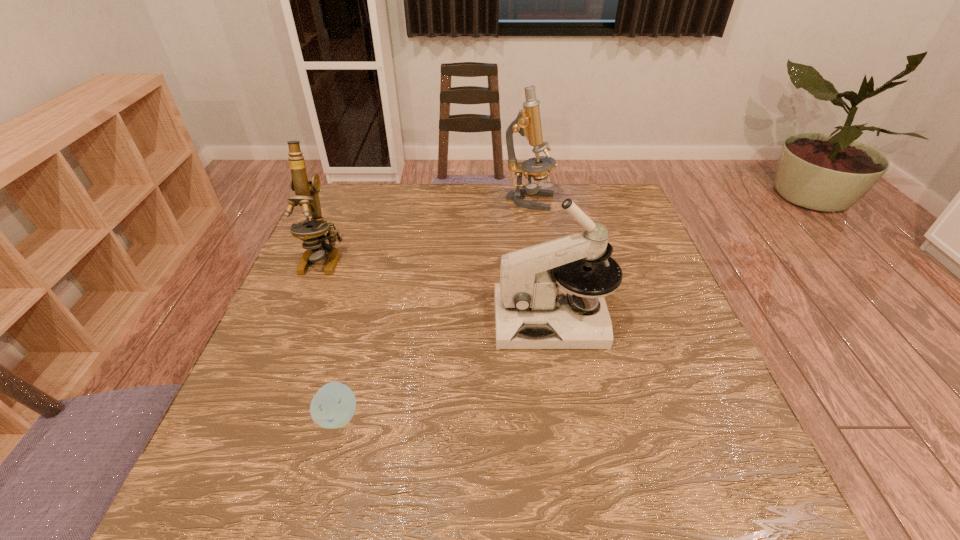
At what (x,y) coordinates should I click in order to perform the action: click on the farthest microscope. Please return your answer as a coordinate pair (x, y). The width and height of the screenshot is (960, 540). Looking at the image, I should click on (528, 122).

Identify the location of the second nearest object. This screenshot has width=960, height=540. (539, 285).

The image size is (960, 540). Find the location of `the third nearest object`. the third nearest object is located at coordinates (312, 233).

Locate an element on the screen. This screenshot has width=960, height=540. the leftmost microscope is located at coordinates (312, 233).

At what (x,y) coordinates should I click in order to perform the action: click on apple. Please return your answer as a coordinate pair (x, y). The height and width of the screenshot is (540, 960). Looking at the image, I should click on (333, 406).

The height and width of the screenshot is (540, 960). Identify the location of the nearest object. (333, 406).

The width and height of the screenshot is (960, 540). In order to click on blank area located on the front of the farthest microscope in this screenshot , I will do `click(543, 295)`.

Locate an element on the screen. vacant space located at the eyepiece of the nearest microscope is located at coordinates (456, 319).

The image size is (960, 540). In order to click on free space located 0.230m at the eyepiece of the nearest microscope in this screenshot , I will do `click(396, 319)`.

Locate an element on the screen. This screenshot has height=540, width=960. free space located at the eyepiece of the nearest microscope is located at coordinates (374, 319).